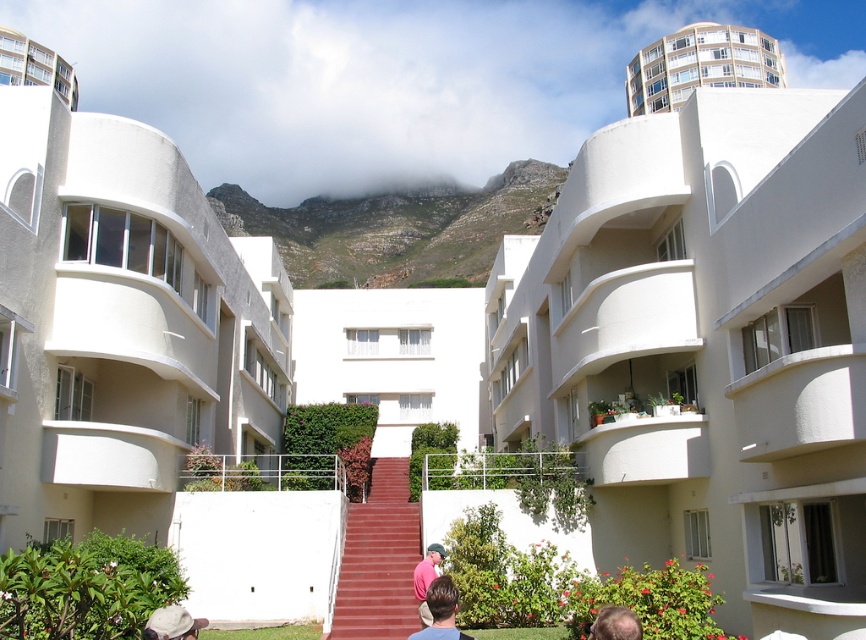
Which is behind, point (125, 476) or point (675, 70)?

The point (675, 70) is more distant.

Locate an element on the screen. The height and width of the screenshot is (640, 866). white smooth building at upper left is located at coordinates (118, 324).

Does smooth red stairs at center appear over white glossy balcony at upper left?

No.

In the scene shown: Who is more distant from viewer, [417,506] or [10,44]?

The point [10,44] is more distant.

Where is `smooth red stairs at center`? smooth red stairs at center is located at coordinates pos(379,560).

Does white glossy building at upper center have a greater width compared to pink fabric shirt at center?

Yes, white glossy building at upper center is wider than pink fabric shirt at center.

Is white glossy building at upper center shorter than pink fabric shirt at center?

No, white glossy building at upper center is not shorter than pink fabric shirt at center.

Find the location of `white glossy building at upper center`. white glossy building at upper center is located at coordinates (700, 65).

At what (x,y) coordinates should I click in order to perform the action: click on white glossy building at upper center. Please return your answer as a coordinate pair (x, y). Looking at the image, I should click on (700, 65).